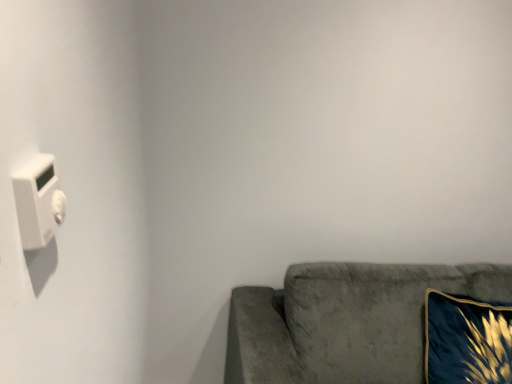
I want to click on velvet blue pillow at lower right, so click(466, 340).

Identify the location of white plastic light switch at left. This screenshot has height=384, width=512. (38, 201).

Which is in front, white plastic light switch at left or velvet blue pillow at lower right?

white plastic light switch at left.

Which is more to the right, white plastic light switch at left or velvet blue pillow at lower right?

From the viewer's perspective, velvet blue pillow at lower right appears more on the right side.

Consider the image. Is white plastic light switch at left with velvet blue pillow at lower right?

white plastic light switch at left and velvet blue pillow at lower right are clearly separated.

From the image's perspective, does white plastic light switch at left appear higher than velvet blue pillow at lower right?

Yes.

Are white plastic light switch at left and velvet gray couch at lower right far apart?

Yes, white plastic light switch at left and velvet gray couch at lower right are quite far apart.

Who is smaller, white plastic light switch at left or velvet gray couch at lower right?

With smaller size is white plastic light switch at left.

Does white plastic light switch at left lie in front of velvet gray couch at lower right?

Yes.

Is point (316, 285) closer to viewer compared to point (495, 374)?

No, it is behind (495, 374).

Between velvet gray couch at lower right and velvet blue pillow at lower right, which one has larger width?

velvet gray couch at lower right.

In the scene shown: From a real-world perspective, who is located lower, velvet gray couch at lower right or velvet blue pillow at lower right?

velvet gray couch at lower right is physically lower.

Is velvet blue pillow at lower right positioned with its back to white plastic light switch at left?

No.

Considering their positions, is velvet blue pillow at lower right located in front of or behind white plastic light switch at left?

In the image, velvet blue pillow at lower right appears behind white plastic light switch at left.

The height and width of the screenshot is (384, 512). In the image, there is a white plastic light switch at left. What are the coordinates of `throw pillow below it (from a real-world perspective)` in the screenshot? It's located at (466, 340).

From a real-world perspective, who is located lower, velvet blue pillow at lower right or white plastic light switch at left?

In real-world perspective, velvet blue pillow at lower right is lower.

Considering the sizes of objects velvet gray couch at lower right and white plastic light switch at left in the image provided, who is thinner, velvet gray couch at lower right or white plastic light switch at left?

Thinner between the two is white plastic light switch at left.

Is velvet gray couch at lower right beside white plastic light switch at left?

No, velvet gray couch at lower right is not beside white plastic light switch at left.

From the image's perspective, is velvet gray couch at lower right above or below white plastic light switch at left?

Based on their image positions, velvet gray couch at lower right is located beneath white plastic light switch at left.

Consider the image. Between velvet blue pillow at lower right and velvet gray couch at lower right, which one is positioned behind?

velvet blue pillow at lower right is further from the camera.

The width and height of the screenshot is (512, 384). Find the location of `studio couch on the left of velvet blue pillow at lower right`. studio couch on the left of velvet blue pillow at lower right is located at coordinates (345, 321).

Is velvet blue pillow at lower right far away from velvet gray couch at lower right?

No, velvet blue pillow at lower right is not far away from velvet gray couch at lower right.

I want to click on light switch in front of the velvet blue pillow at lower right, so click(38, 201).

The width and height of the screenshot is (512, 384). In order to click on studio couch located underneath the white plastic light switch at left (from a real-world perspective) in this screenshot , I will do `click(345, 321)`.

Estimate the real-world distances between objects in this image. Which object is further from velvet gray couch at lower right, white plastic light switch at left or velvet blue pillow at lower right?

white plastic light switch at left.

Considering their positions, is velvet gray couch at lower right positioned closer to white plastic light switch at left than velvet blue pillow at lower right?

Among the two, velvet gray couch at lower right is located nearer to white plastic light switch at left.

Considering their positions, is velvet gray couch at lower right positioned closer to velvet blue pillow at lower right than white plastic light switch at left?

Among the two, velvet gray couch at lower right is located nearer to velvet blue pillow at lower right.

Which object lies further to the anchor point white plastic light switch at left, velvet blue pillow at lower right or velvet gray couch at lower right?

Based on the image, velvet blue pillow at lower right appears to be further to white plastic light switch at left.

Consider the image. Which object lies nearer to the anchor point velvet blue pillow at lower right, white plastic light switch at left or velvet gray couch at lower right?

The object closer to velvet blue pillow at lower right is velvet gray couch at lower right.

Looking at the image, which one is located closer to velvet gray couch at lower right, velvet blue pillow at lower right or white plastic light switch at left?

velvet blue pillow at lower right is closer to velvet gray couch at lower right.

Image resolution: width=512 pixels, height=384 pixels. Identify the location of studio couch situated between white plastic light switch at left and velvet blue pillow at lower right from left to right. (345, 321).